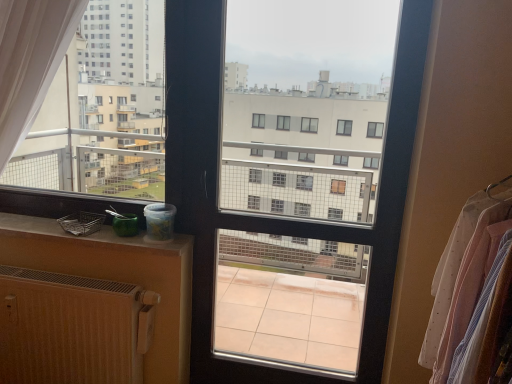
Question: Visually, is white sheer fabric at right positioned to the left or to the right of clear glass window screen at center?

Choices:
 (A) left
 (B) right

Answer: (B)

Question: Considering the positions of white sheer fabric at right and clear glass window screen at center in the image, is white sheer fabric at right bigger or smaller than clear glass window screen at center?

Choices:
 (A) big
 (B) small

Answer: (A)

Question: Which is farther from the matte plastic container at lower left?

Choices:
 (A) white sheer fabric at right
 (B) clear glass window screen at center
 (C) wooden radiator at lower left
 (D) white matte plastic container at left

Answer: (B)

Question: Which object is positioned farthest from the white sheer fabric at right?

Choices:
 (A) wooden radiator at lower left
 (B) white matte plastic container at left
 (C) matte plastic container at lower left
 (D) clear glass window screen at center

Answer: (D)